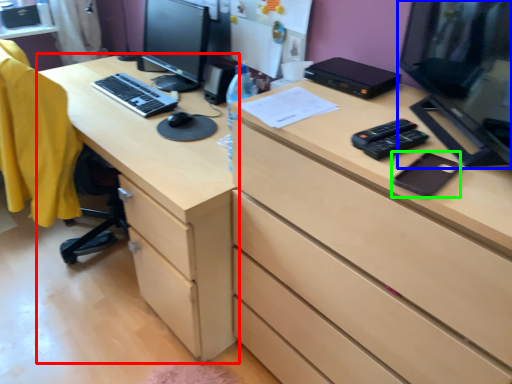
Question: Based on their relative distances, which object is farther from desk (highlighted by a red box)? Choose from computer monitor (highlighted by a blue box) and notepad (highlighted by a green box).

Choices:
 (A) computer monitor
 (B) notepad

Answer: (B)